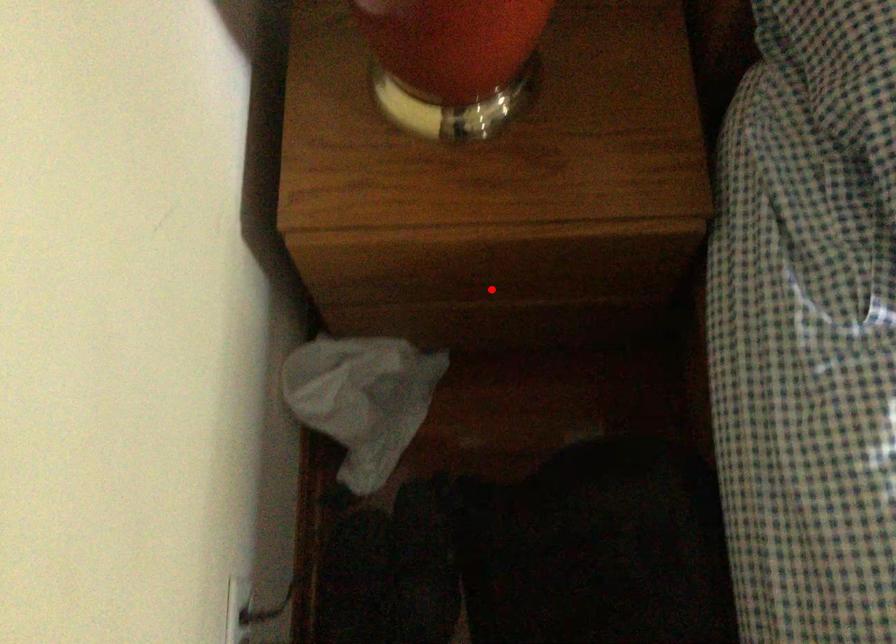
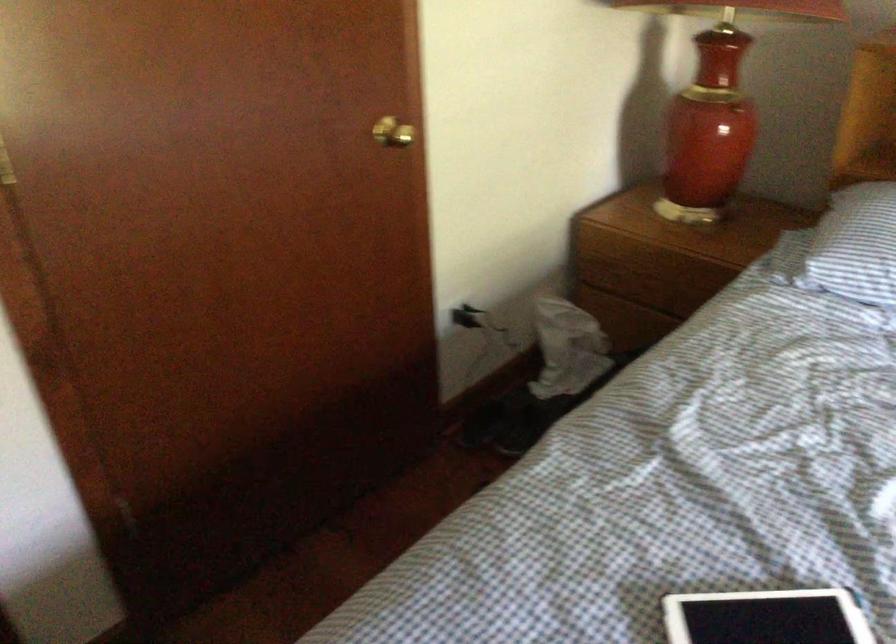
Locate, in the second image, the point that corresponds to the highlighted location in the first image.

(650, 283)